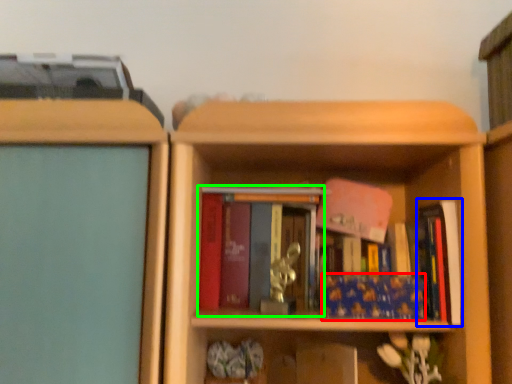
Question: Which object is the closest to the book (highlighted by a red box)? Choose among these: book (highlighted by a blue box) or book (highlighted by a green box).

Choices:
 (A) book
 (B) book

Answer: (A)